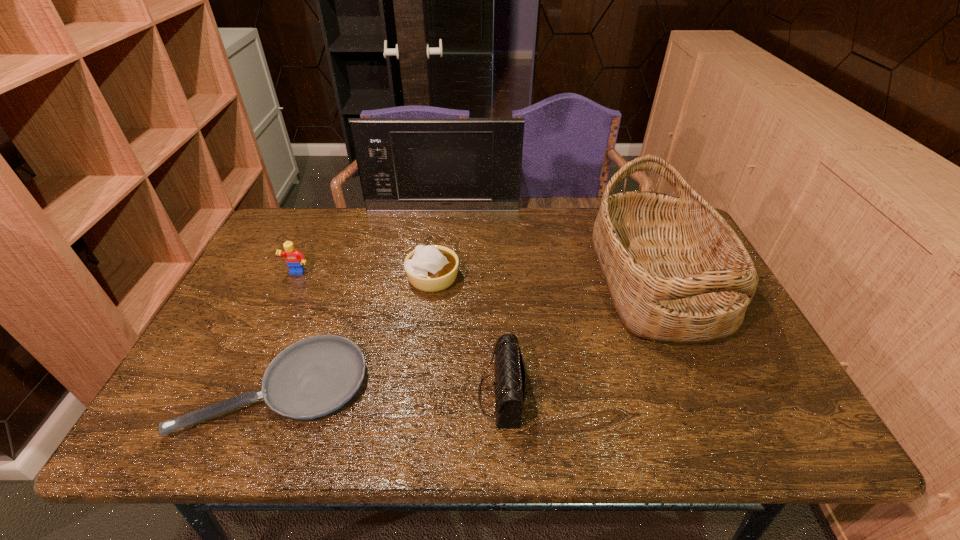
Find the location of a particular element. microwave oven is located at coordinates (405, 164).

Locate an element on the screen. the farthest object is located at coordinates (405, 164).

Where is `the rightmost object`? the rightmost object is located at coordinates (676, 271).

Where is `the fifth shortest object`? The width and height of the screenshot is (960, 540). the fifth shortest object is located at coordinates (676, 271).

Find the location of a particular element. whipped cream is located at coordinates (432, 268).

Identify the location of Lego. coord(294,259).

What are the coordinates of `clutch bag` in the screenshot? It's located at (510, 381).

You are a GUI agent. You are given a task and a screenshot of the screen. Output one action in this format:
    pyautogui.click(x=<x>, y=<y>)
    Task: Click on the shortest object
    This screenshot has width=960, height=540.
    Given the screenshot: What is the action you would take?
    pyautogui.click(x=313, y=377)

At what (x,y) coordinates should I click in order to perform the action: click on vacant area located 0.170m on the front panel of the tallest object. Please return your answer as a coordinate pair (x, y). The height and width of the screenshot is (540, 960). Looking at the image, I should click on (439, 242).

At what (x,y) coordinates should I click in order to perform the action: click on vacant region located 0.120m on the front of the rightmost object. Please return your answer as a coordinate pair (x, y). Looking at the image, I should click on (708, 402).